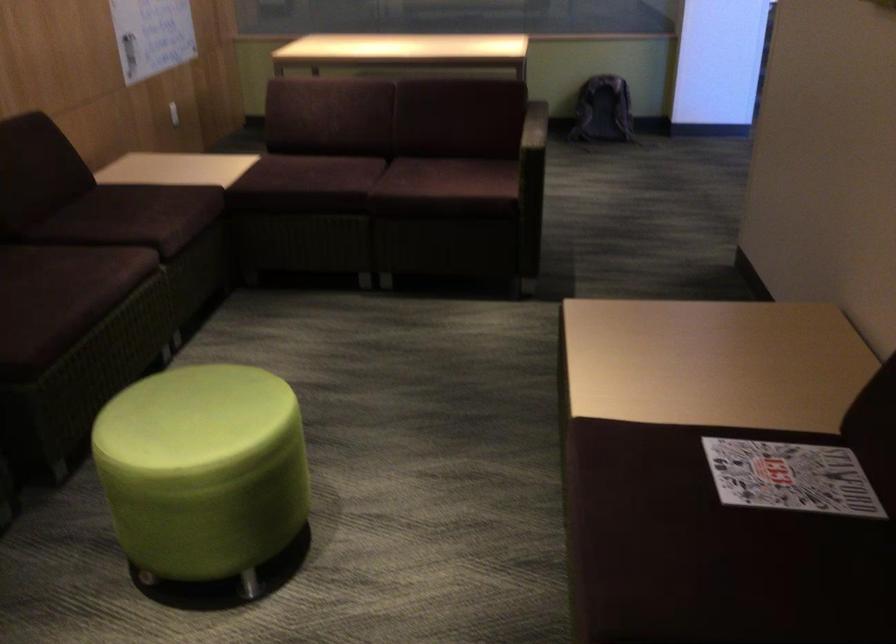
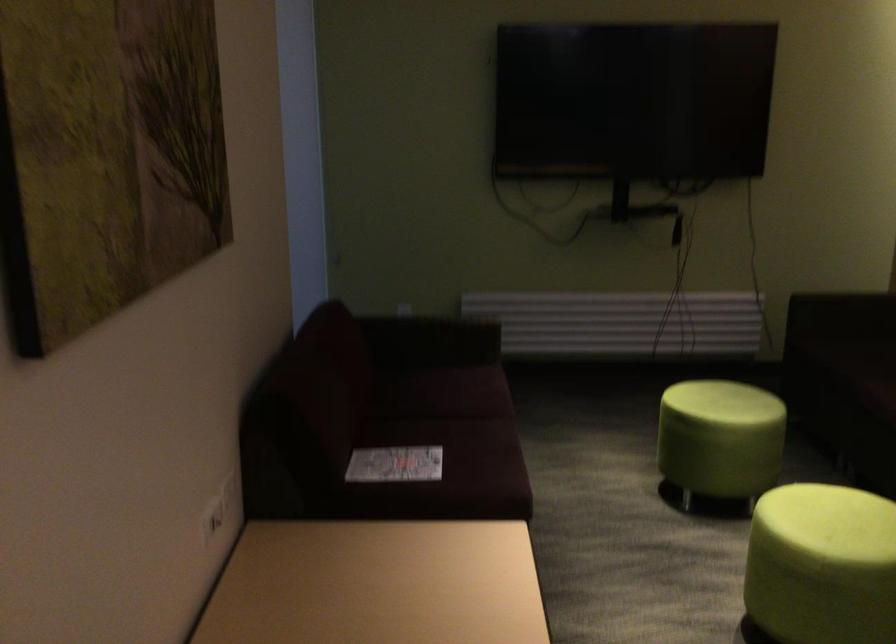
The point at [789,483] is marked in the first image. Where is the corresponding point in the second image?

(394, 464)